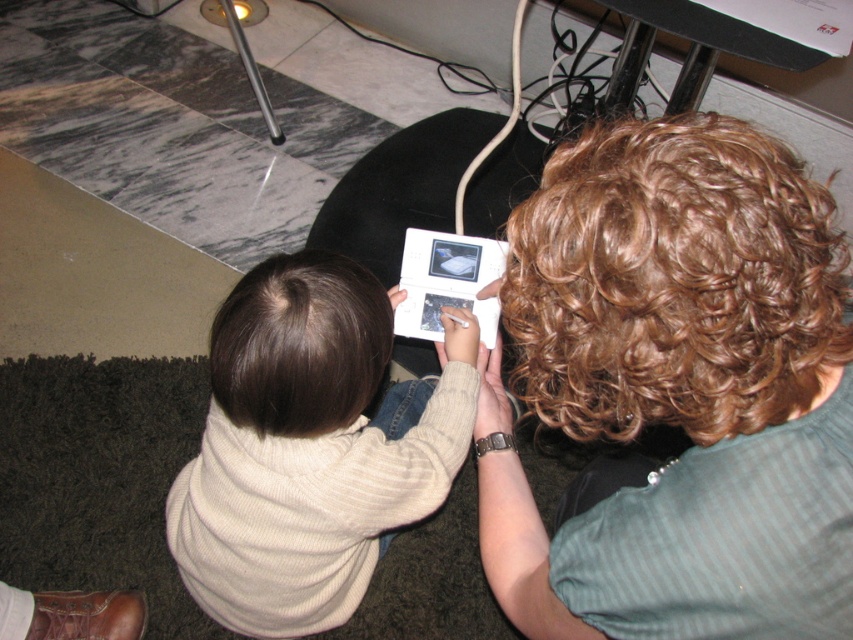
You are a photographer trying to capture a closeup of the white glossy ipod at center without including the curly brown hair at upper right in the frame. Based on their positions, is this possible?

The curly brown hair at upper right is positioned on the right side of the white glossy ipod at center, so it is possible to frame the shot to exclude the curly brown hair at upper right by focusing on the left side of the white glossy ipod at center.

You are standing in the room and want to reach the point marked at coordinates (578, 260). If your arm length is 24 inches, can you comfortably reach it without moving your feet?

The point marked at coordinates (578, 260) is 19.35 inches away from the viewer. Since your arm length is 24 inches, you can comfortably reach it without moving your feet.

You are standing in front of the scene and want to reach the point marked as point (752, 284). If your hand can extend 18 inches, can you reach it?

The point (752, 284) is 18.68 inches away from the viewer. Since your hand can extend 18 inches, you cannot reach it as it is slightly farther than your reach.